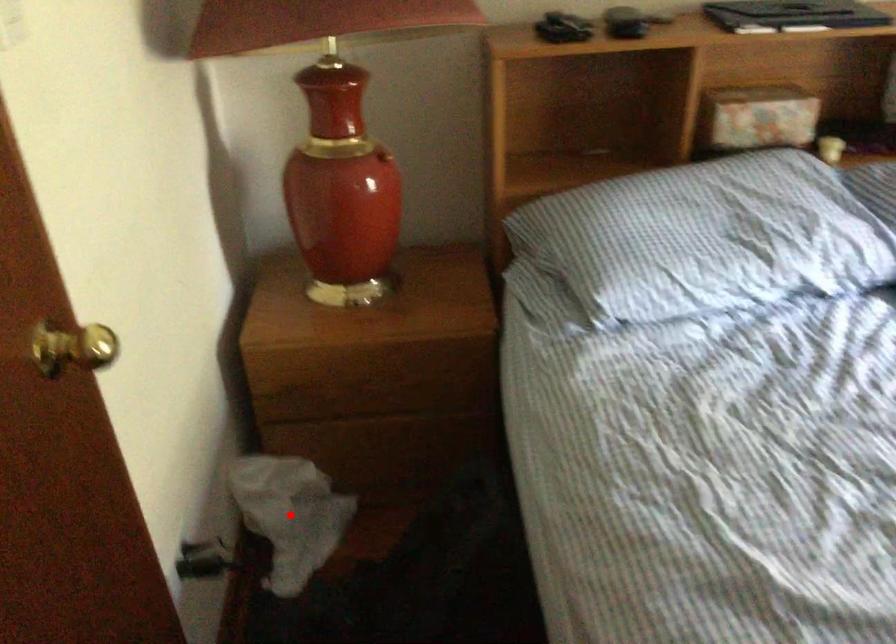
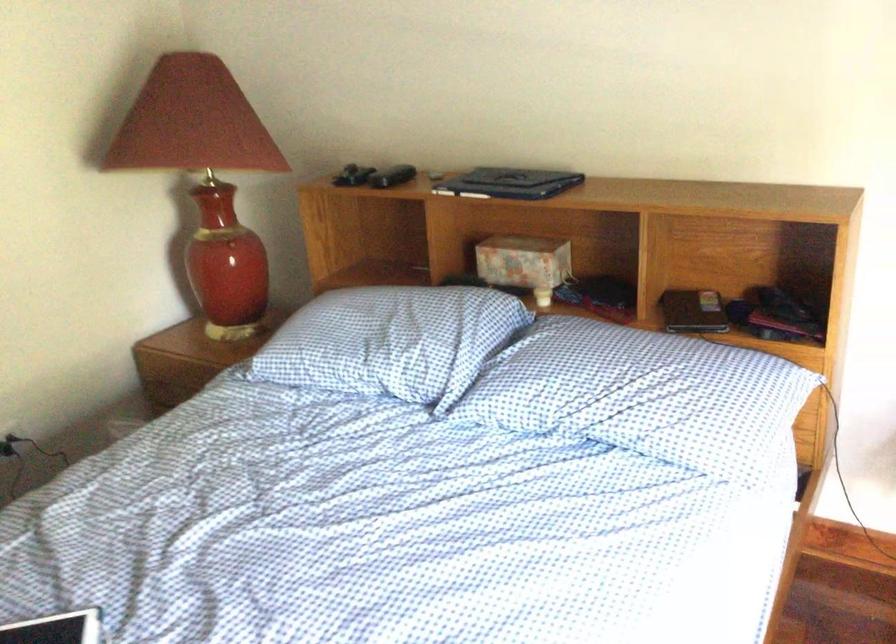
Question: I am providing you with two images of the same scene from different viewpoints. A red point is marked on the first image. Is the red point's position out of view in image 2?

Choices:
 (A) Yes
 (B) No

Answer: (A)